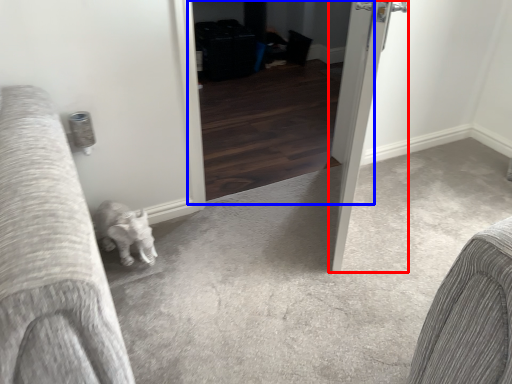
Question: Among these objects, which one is farthest to the camera, door (highlighted by a red box) or screen door (highlighted by a blue box)?

Choices:
 (A) door
 (B) screen door

Answer: (B)